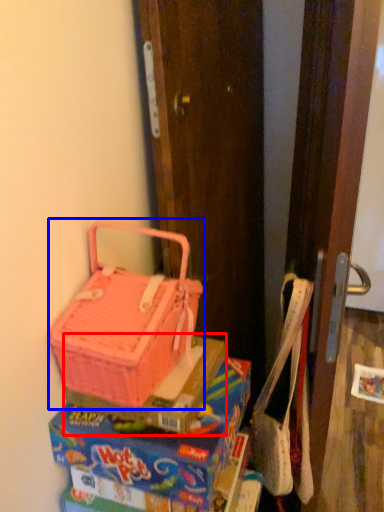
Question: Among these objects, which one is nearest to the camera, box (highlighted by a red box) or picnic basket (highlighted by a blue box)?

Choices:
 (A) box
 (B) picnic basket

Answer: (B)